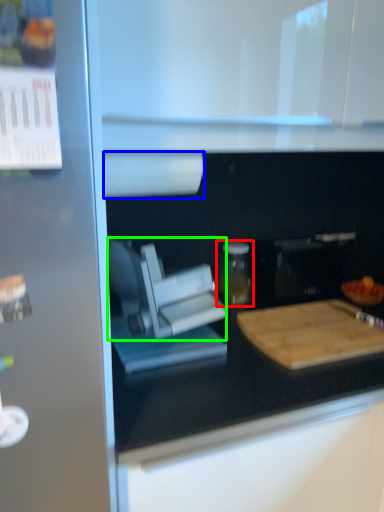
Question: Which object is the closest to the bottle (highlighted by a red box)? Choose among these: paper towel (highlighted by a blue box) or appliance (highlighted by a green box).

Choices:
 (A) paper towel
 (B) appliance

Answer: (B)